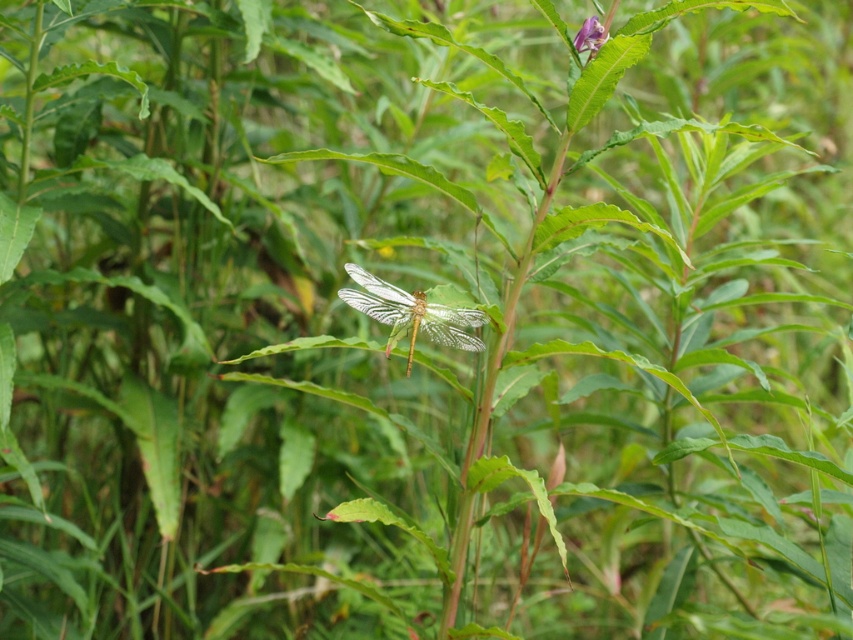
Question: Which of the following is the closest to the observer?

Choices:
 (A) (473, 310)
 (B) (596, 45)

Answer: (A)

Question: Is translucent glass dragonfly at center smaller than purple matte flower at upper right?

Choices:
 (A) yes
 (B) no

Answer: (B)

Question: Can you confirm if translucent glass dragonfly at center is smaller than purple matte flower at upper right?

Choices:
 (A) yes
 (B) no

Answer: (B)

Question: Is translucent glass dragonfly at center above purple matte flower at upper right?

Choices:
 (A) no
 (B) yes

Answer: (A)